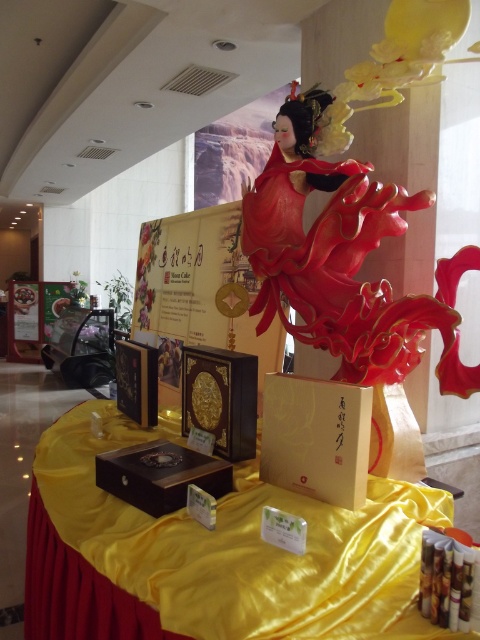
You are a customer in a store that sells clothing and accessories. You see a yellow satin table at center and a glossy red dress at center. Which object is taller?

The glossy red dress at center is taller than the yellow satin table at center.

You are a delivery person who needs to place a small package on the yellow satin table at center. The package is 30 inches wide. Can you place it on the table without moving the glossy red dress at center?

The yellow satin table at center and glossy red dress at center are 28.56 inches apart from each other. Since the package is 30 inches wide, it would overlap the space between them, so you cannot place it without moving the glossy red dress at center.

You are a visitor at the exhibition and you want to take a photo of the glossy red dress at center and the matte gold cardboard box at center. If you stand in front of the display, which object should you focus on first to ensure both are in the frame?

You should focus on the matte gold cardboard box at center first because the glossy red dress at center is to the right of it, so by centering the box, you can adjust the camera to include both objects in the frame.